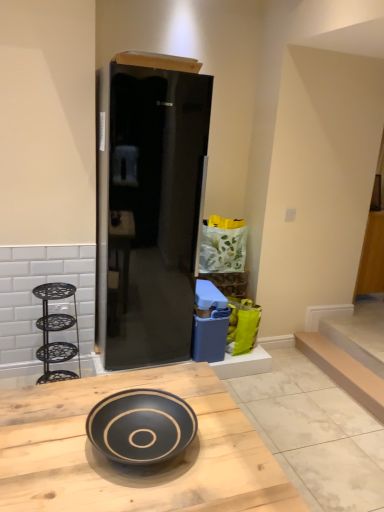
What do you see at coordinates (134, 466) in the screenshot? I see `black matte bowl at center` at bounding box center [134, 466].

This screenshot has width=384, height=512. Describe the element at coordinates (149, 212) in the screenshot. I see `black glass refrigerator at center` at that location.

The width and height of the screenshot is (384, 512). Identify the location of black glass refrigerator at center. (149, 212).

What do you see at coordinates (56, 330) in the screenshot? I see `black wrought iron shelving unit at left` at bounding box center [56, 330].

Find the location of a particular element. matte cardboard box at upper center is located at coordinates (157, 61).

Where is `black matte bowl at center`? This screenshot has height=512, width=384. black matte bowl at center is located at coordinates (134, 466).

Between black wrought iron shelving unit at left and black glossy bowl at center, which one has less height?

Standing shorter between the two is black glossy bowl at center.

Is black glossy bowl at center surrounded by black wrought iron shelving unit at left?

No, black wrought iron shelving unit at left does not contain black glossy bowl at center.

From the picture: Which object is closer to the camera, black wrought iron shelving unit at left or black glossy bowl at center?

black glossy bowl at center is in front.

What's the angular difference between black wrought iron shelving unit at left and black glossy bowl at center's facing directions?

There is a 91-degree angle between the facing directions of black wrought iron shelving unit at left and black glossy bowl at center.

Where is `bowl located on the left of smooth beige stair at lower right`? bowl located on the left of smooth beige stair at lower right is located at coordinates (141, 426).

From a real-world perspective, is black glossy bowl at center on top of smooth beige stair at lower right?

Correct, in the physical world, black glossy bowl at center is higher than smooth beige stair at lower right.

Can you confirm if black glossy bowl at center is positioned to the left of smooth beige stair at lower right?

Yes, black glossy bowl at center is to the left of smooth beige stair at lower right.

From the picture: Is black glossy bowl at center positioned with its back to smooth beige stair at lower right?

black glossy bowl at center is not turned away from smooth beige stair at lower right.

Which is more distant, (313,361) or (181,68)?

Positioned behind is point (313,361).

Looking at this image, considering the relative sizes of smooth beige stair at lower right and matte cardboard box at upper center in the image provided, is smooth beige stair at lower right thinner than matte cardboard box at upper center?

Yes, smooth beige stair at lower right is thinner than matte cardboard box at upper center.

Does smooth beige stair at lower right come behind matte cardboard box at upper center?

Yes, the depth of smooth beige stair at lower right is greater than that of matte cardboard box at upper center.

Between smooth beige stair at lower right and matte cardboard box at upper center, which one appears on the right side from the viewer's perspective?

smooth beige stair at lower right is more to the right.

Is smooth beige stair at lower right in front of or behind black matte bowl at center in the image?

In the image, smooth beige stair at lower right appears behind black matte bowl at center.

Which is more to the left, smooth beige stair at lower right or black matte bowl at center?

black matte bowl at center is more to the left.

From the image's perspective, is smooth beige stair at lower right over black matte bowl at center?

Yes.

Does smooth beige stair at lower right have a smaller size compared to black matte bowl at center?

Yes.

Is black glossy bowl at center in contact with black wrought iron shelving unit at left?

No, black glossy bowl at center is not beside black wrought iron shelving unit at left.

Does black glossy bowl at center have a larger size compared to black wrought iron shelving unit at left?

Incorrect, black glossy bowl at center is not larger than black wrought iron shelving unit at left.

What's the angular difference between black glossy bowl at center and black wrought iron shelving unit at left's facing directions?

91 degrees.

From a real-world perspective, is black glossy bowl at center physically located above or below black wrought iron shelving unit at left?

In terms of real-world spatial position, black glossy bowl at center is above black wrought iron shelving unit at left.

Is black glass refrigerator at center facing away from smooth beige stair at lower right?

No.

How many degrees apart are the facing directions of black glass refrigerator at center and smooth beige stair at lower right?

They differ by 88.8 degrees in their facing directions.

Who is shorter, black glass refrigerator at center or smooth beige stair at lower right?

Standing shorter between the two is smooth beige stair at lower right.

Based on the photo, from the image's perspective, is black glass refrigerator at center above or below smooth beige stair at lower right?

Based on their image positions, black glass refrigerator at center is located above smooth beige stair at lower right.

Can you confirm if black matte bowl at center is bigger than black glass refrigerator at center?

Incorrect, black matte bowl at center is not larger than black glass refrigerator at center.

In the scene shown: Which object is closer to the camera, black matte bowl at center or black glass refrigerator at center?

black matte bowl at center.

Measure the distance from black matte bowl at center to black glass refrigerator at center.

4.30 feet.

Does black matte bowl at center appear on the left side of black glass refrigerator at center?

Incorrect, black matte bowl at center is not on the left side of black glass refrigerator at center.

The height and width of the screenshot is (512, 384). Identify the location of bowl above the black wrought iron shelving unit at left (from a real-world perspective). (141, 426).

The height and width of the screenshot is (512, 384). What are the coordinates of `stair that appears below the black glossy bowl at center (from the image's perspective)` in the screenshot? It's located at click(x=344, y=371).

From the picture: Looking at the image, which one is located closer to black glass refrigerator at center, smooth beige stair at lower right or matte cardboard box at upper center?

matte cardboard box at upper center is closer to black glass refrigerator at center.

When comparing their distances from black glass refrigerator at center, does black wrought iron shelving unit at left or black glossy bowl at center seem closer?

Based on the image, black wrought iron shelving unit at left appears to be nearer to black glass refrigerator at center.

Estimate the real-world distances between objects in this image. Which object is closer to black matte bowl at center, black glossy bowl at center or black glass refrigerator at center?

black glossy bowl at center.

Which object lies nearer to the anchor point black glass refrigerator at center, black glossy bowl at center or smooth beige stair at lower right?

Based on the image, black glossy bowl at center appears to be nearer to black glass refrigerator at center.

Looking at the image, which one is located closer to smooth beige stair at lower right, black glossy bowl at center or black wrought iron shelving unit at left?

black wrought iron shelving unit at left is positioned closer to the anchor smooth beige stair at lower right.

Looking at this image, based on their spatial positions, is matte cardboard box at upper center or black wrought iron shelving unit at left closer to smooth beige stair at lower right?

black wrought iron shelving unit at left is positioned closer to the anchor smooth beige stair at lower right.

Looking at the image, which one is located closer to black wrought iron shelving unit at left, black glass refrigerator at center or black matte bowl at center?

Based on the image, black glass refrigerator at center appears to be nearer to black wrought iron shelving unit at left.

Looking at this image, from the image, which object appears to be nearer to matte cardboard box at upper center, black matte bowl at center or black glossy bowl at center?

black matte bowl at center.

Locate an element on the screen. This screenshot has height=512, width=384. cabinetry between black glass refrigerator at center and black matte bowl at center vertically is located at coordinates (56, 330).

Where is `door between black glossy bowl at center and black wrought iron shelving unit at left in the front-back direction`? This screenshot has width=384, height=512. door between black glossy bowl at center and black wrought iron shelving unit at left in the front-back direction is located at coordinates (149, 212).

Image resolution: width=384 pixels, height=512 pixels. Find the location of `bowl between black glass refrigerator at center and black matte bowl at center vertically`. bowl between black glass refrigerator at center and black matte bowl at center vertically is located at coordinates (141, 426).

Where is `door between black glossy bowl at center and smooth beige stair at lower right along the z-axis`? This screenshot has height=512, width=384. door between black glossy bowl at center and smooth beige stair at lower right along the z-axis is located at coordinates (149, 212).